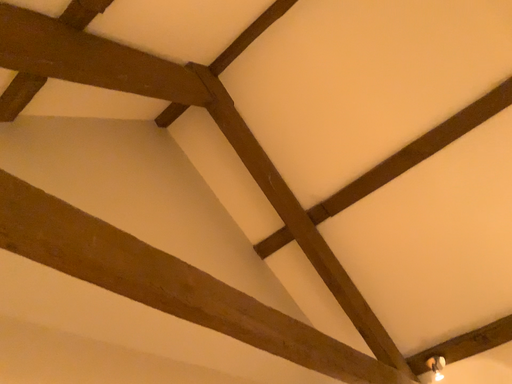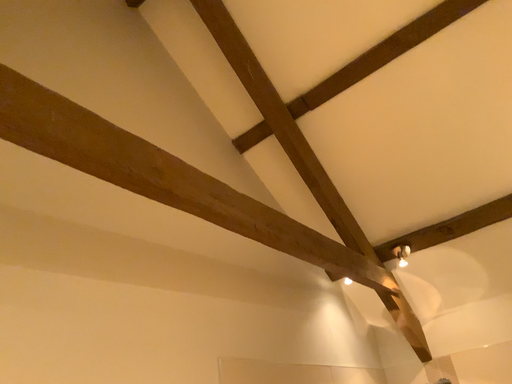
Question: Which way did the camera rotate in the video?

Choices:
 (A) rotated downward
 (B) rotated upward

Answer: (A)